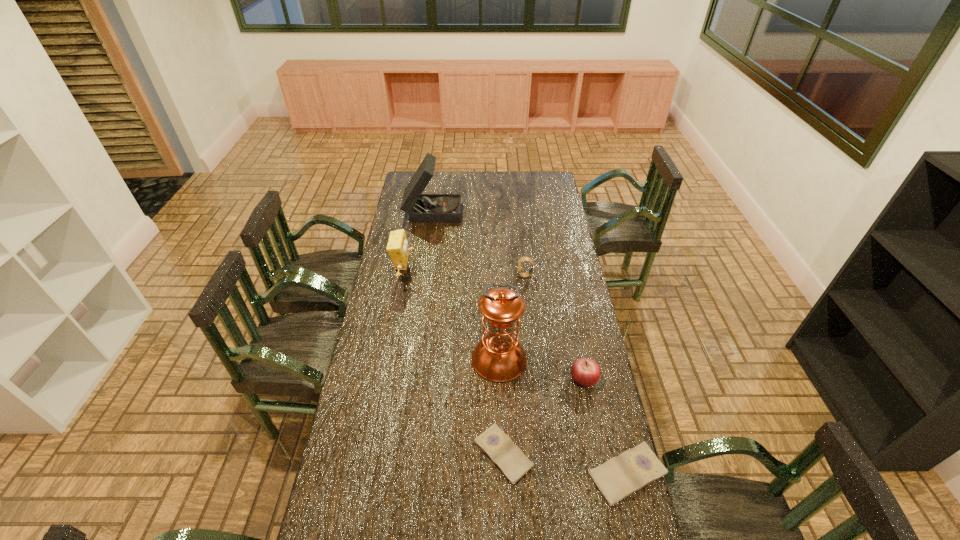
You are a GUI agent. You are given a task and a screenshot of the screen. Output one action in this format:
    pyautogui.click(x=<x>, y=<y>)
    Task: Click on the left diary
    The height and width of the screenshot is (540, 960).
    Given the screenshot: What is the action you would take?
    pyautogui.click(x=510, y=460)

Identify the location of the shorter diary. This screenshot has width=960, height=540. pyautogui.click(x=510, y=460).

This screenshot has width=960, height=540. Identify the location of the right diary. (620, 476).

The image size is (960, 540). I want to click on the taller diary, so coord(620,476).

Identify the location of the sixth shortest object. The height and width of the screenshot is (540, 960). (423, 208).

Locate an element on the screen. phonograph_record is located at coordinates (423, 208).

You are a GUI agent. You are given a task and a screenshot of the screen. Output one action in this format:
    pyautogui.click(x=<x>, y=<y>)
    Task: Click on the fifth shortest object
    
    Given the screenshot: What is the action you would take?
    pyautogui.click(x=397, y=247)

The width and height of the screenshot is (960, 540). What are the coordinates of `apple` in the screenshot? It's located at (585, 372).

You are a GUI agent. You are given a task and a screenshot of the screen. Output one action in this format:
    pyautogui.click(x=<x>, y=<y>)
    Task: Click on the watch
    
    Given the screenshot: What is the action you would take?
    pyautogui.click(x=527, y=274)

You are a GUI agent. You are given a task and a screenshot of the screen. Output one action in this format:
    pyautogui.click(x=<x>, y=<y>)
    Task: Click on the oil lamp
    
    Given the screenshot: What is the action you would take?
    pyautogui.click(x=498, y=357)